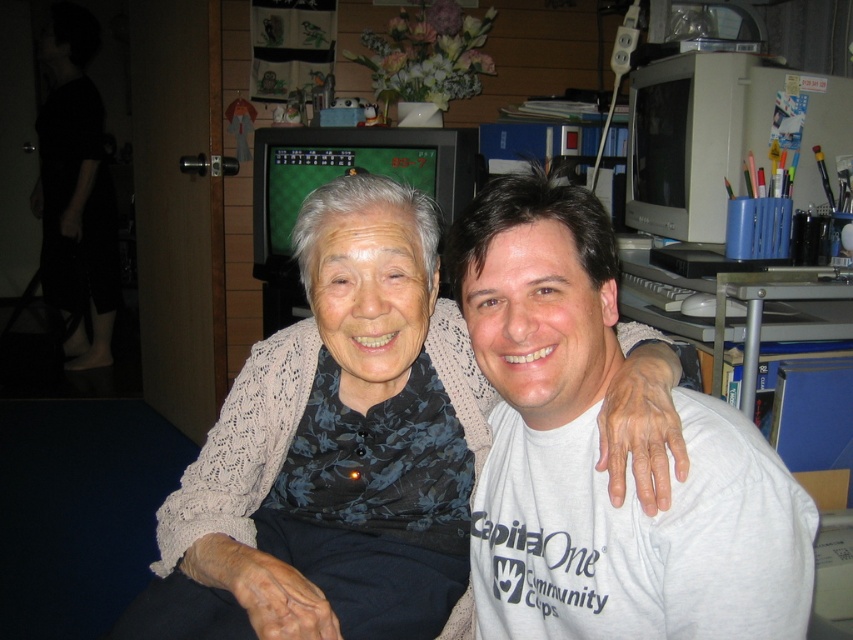
Question: Where is white cotton t-shirt at center located in relation to dark blue fabric at lower left in the image?

Choices:
 (A) left
 (B) right

Answer: (B)

Question: Can you confirm if knitted beige sweater at center is smaller than white cotton t-shirt at center?

Choices:
 (A) no
 (B) yes

Answer: (A)

Question: Based on their relative distances, which object is farther from the knitted beige sweater at center?

Choices:
 (A) dark blue fabric at lower left
 (B) white cotton t-shirt at center

Answer: (B)

Question: Among these objects, which one is farthest from the camera?

Choices:
 (A) knitted beige sweater at center
 (B) dark blue fabric at lower left

Answer: (B)

Question: Does knitted beige sweater at center appear on the left side of dark blue fabric at lower left?

Choices:
 (A) no
 (B) yes

Answer: (A)

Question: Which object is positioned closest to the dark blue fabric at lower left?

Choices:
 (A) white cotton t-shirt at center
 (B) knitted beige sweater at center

Answer: (B)